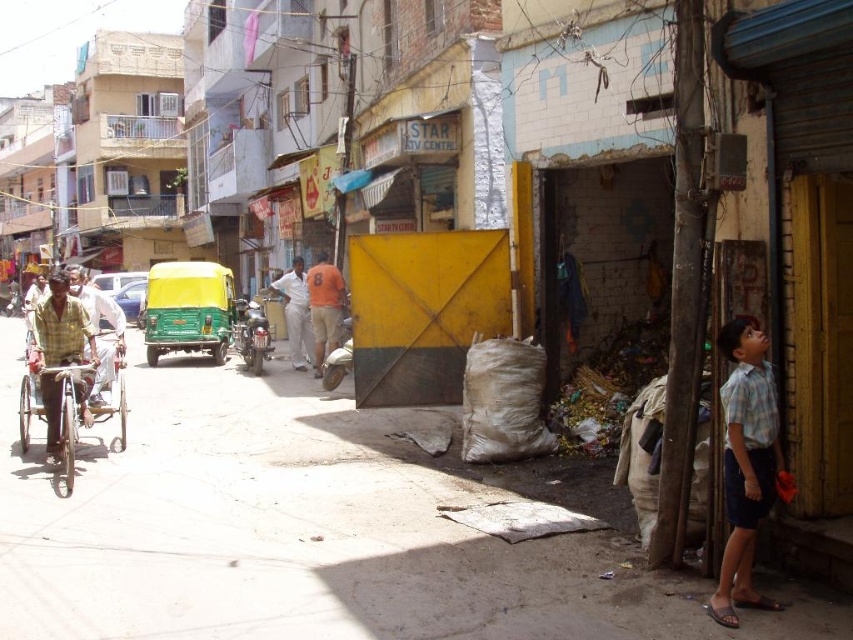
You are a delivery person who needs to place a large package on the cart. Which cart, the wooden brown cart at left or the yellow fabric cart at left, can you place the package on if the package requires a taller cart?

The yellow fabric cart at left is taller than the wooden brown cart at left, so you should place the package on the yellow fabric cart at left.

You are a delivery person on a bike, and you need to pass between the two points marked as point (328, 292) and point (300, 365). Since you have to maintain a distance of at least 0.1 units from each point to avoid obstacles, can you safely navigate through this path?

Point (328, 292) is in front of point (300, 365). The distance between them is not specified, but since you need to stay at least 0.1 units away from each, the path may be too narrow. Without knowing the exact distance, it is unsafe to proceed.

You are a delivery person who needs to quickly move your cart from the wooden brown cart at left to the yellow fabric cart at left. Given that your cart requires a minimum of 12 feet of space to maneuver, do you think you can navigate through the space between them?

The distance between the wooden brown cart at left and yellow fabric cart at left is 11.93 feet, which is slightly less than the required 12 feet. Therefore, you cannot navigate through the space between them with your cart.